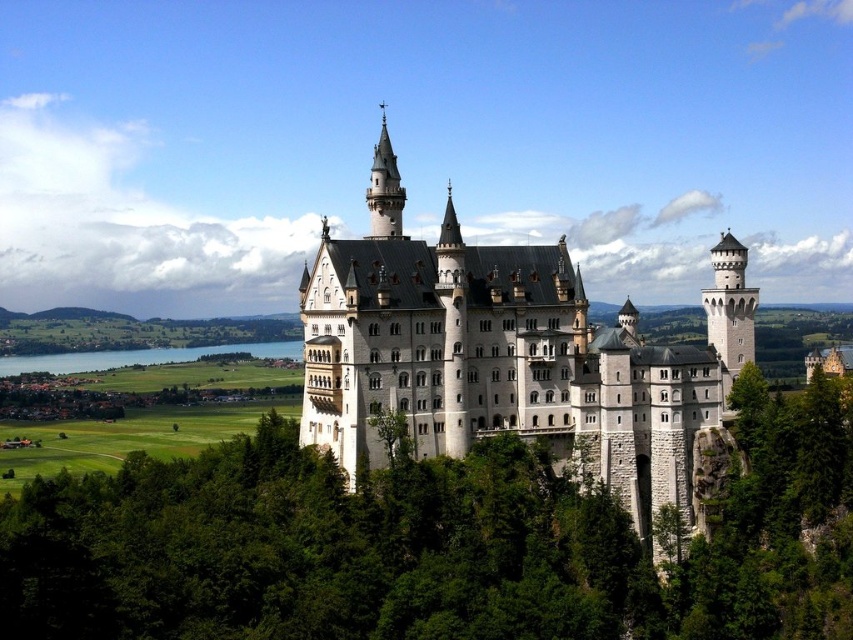
Question: Among these points, which one is nearest to the camera?

Choices:
 (A) (410, 282)
 (B) (138, 362)
 (C) (755, 593)

Answer: (C)

Question: Which of these objects is positioned farthest from the white stone castle at center?

Choices:
 (A) blue water at lower left
 (B) green leafy tree at center

Answer: (A)

Question: Can you confirm if white stone castle at center is positioned to the right of blue water at lower left?

Choices:
 (A) no
 (B) yes

Answer: (B)

Question: Does white stone castle at center appear on the right side of blue water at lower left?

Choices:
 (A) no
 (B) yes

Answer: (B)

Question: Which point is closer to the camera?

Choices:
 (A) (61, 356)
 (B) (750, 632)
 (C) (491, 413)

Answer: (B)

Question: In this image, where is white stone castle at center located relative to blue water at lower left?

Choices:
 (A) right
 (B) left

Answer: (A)